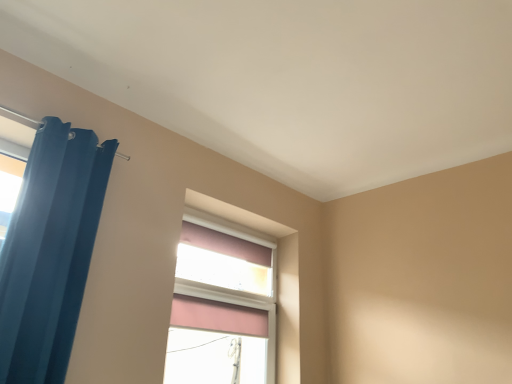
Question: In the image, is matte blue curtain at left on the left side or the right side of pink fabric window at center?

Choices:
 (A) left
 (B) right

Answer: (A)

Question: From a real-world perspective, is matte blue curtain at left physically located above or below pink fabric window at center?

Choices:
 (A) below
 (B) above

Answer: (B)

Question: Considering their positions, is matte blue curtain at left located in front of or behind pink fabric window at center?

Choices:
 (A) front
 (B) behind

Answer: (A)

Question: Is point (236, 243) positioned closer to the camera than point (84, 279)?

Choices:
 (A) farther
 (B) closer

Answer: (A)

Question: From the image's perspective, is pink fabric window at center positioned above or below matte blue curtain at left?

Choices:
 (A) below
 (B) above

Answer: (A)

Question: In terms of size, does pink fabric window at center appear bigger or smaller than matte blue curtain at left?

Choices:
 (A) small
 (B) big

Answer: (A)

Question: Relative to matte blue curtain at left, is pink fabric window at center in front or behind?

Choices:
 (A) behind
 (B) front

Answer: (A)